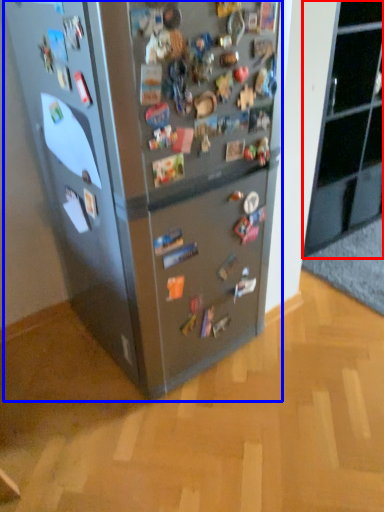
Question: Among these objects, which one is farthest to the camera, cabinetry (highlighted by a red box) or refrigerator (highlighted by a blue box)?

Choices:
 (A) cabinetry
 (B) refrigerator

Answer: (A)